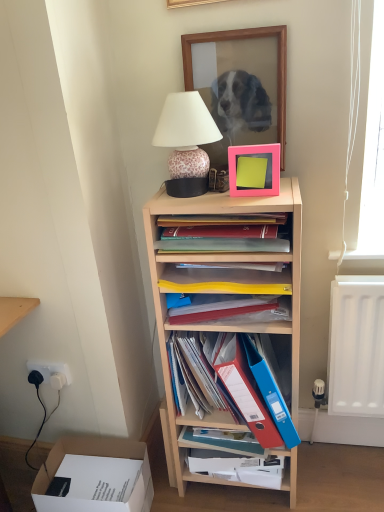
This screenshot has height=512, width=384. In order to click on free space in front of leopard print ceramic lamp at upper center in this screenshot , I will do `click(210, 200)`.